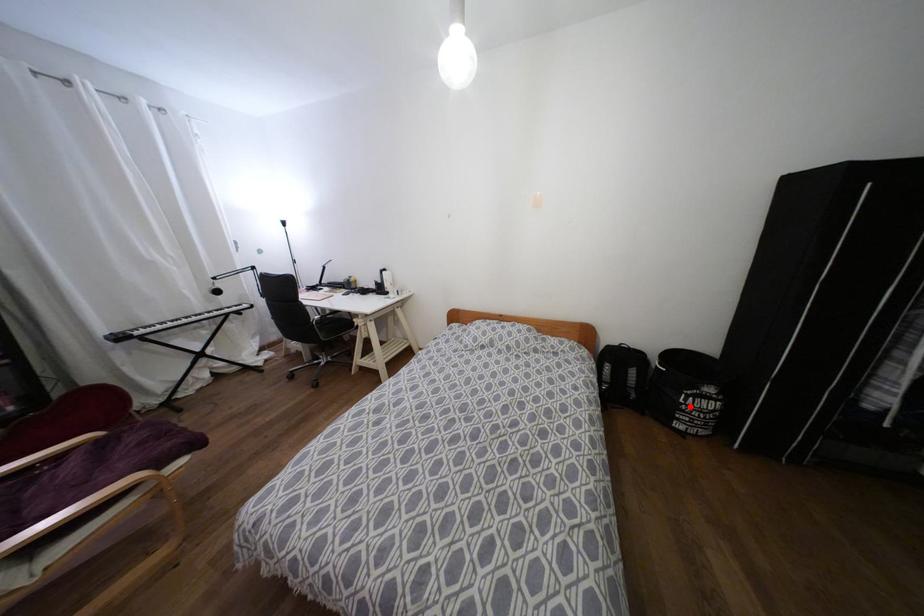
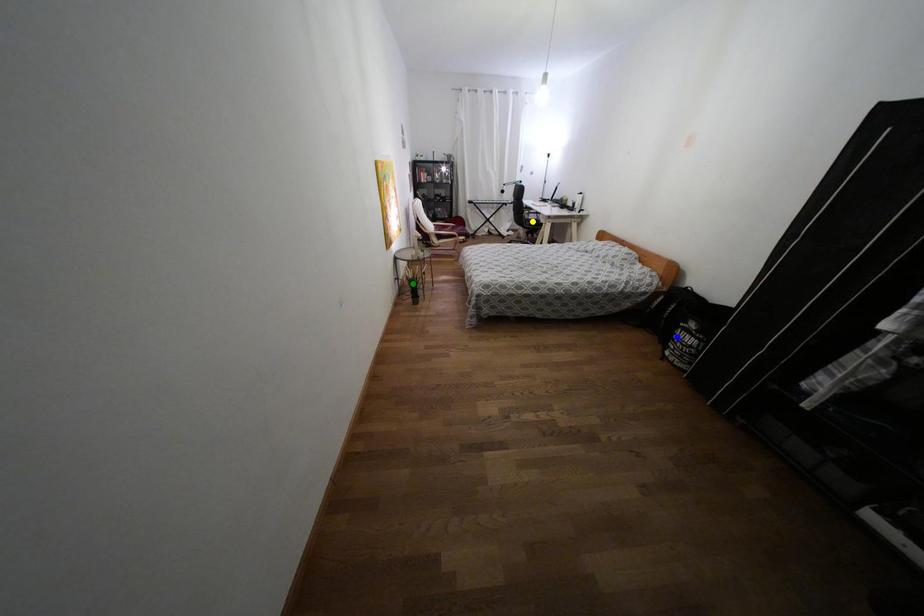
Question: I am providing you with two images of the same scene from different viewpoints. A red point is marked on the first image. You are given multiple points on the second image. Which point in image 2 is actually the same real-world point as the red point in image 1?

Choices:
 (A) blue point
 (B) yellow point
 (C) green point

Answer: (A)